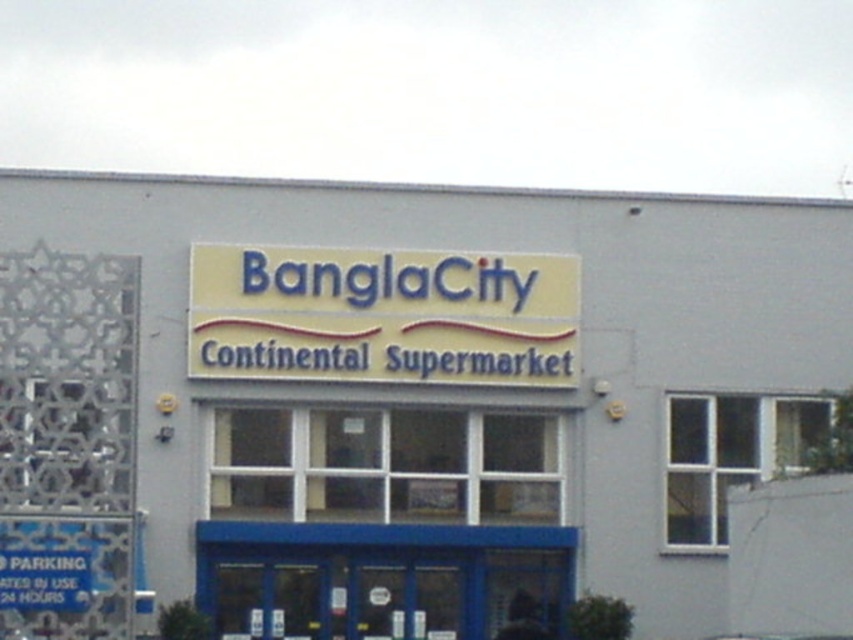
Is point (381, 225) closer to viewer compared to point (340, 372)?

That is False.

At what (x,y) coordinates should I click in order to perform the action: click on white matte sign at center. Please return your answer as a coordinate pair (x, y). The width and height of the screenshot is (853, 640). Looking at the image, I should click on (x=416, y=408).